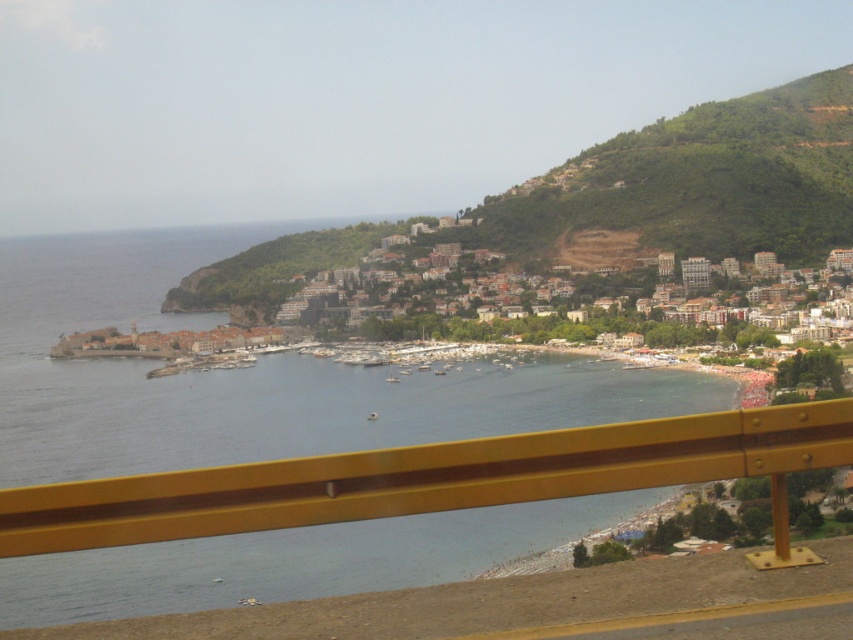
Question: Which point is closer to the camera taking this photo?

Choices:
 (A) [x=573, y=292]
 (B) [x=793, y=422]

Answer: (B)

Question: Which point is farther to the camera?

Choices:
 (A) (523, 472)
 (B) (339, 320)

Answer: (B)

Question: Among these objects, which one is nearest to the camera?

Choices:
 (A) brown stone buildings at center
 (B) yellow metallic rail at lower center

Answer: (B)

Question: Is yellow metallic rail at lower center below brown stone buildings at center?

Choices:
 (A) no
 (B) yes

Answer: (B)

Question: Does yellow metallic rail at lower center have a larger size compared to brown stone buildings at center?

Choices:
 (A) no
 (B) yes

Answer: (A)

Question: Does yellow metallic rail at lower center appear on the right side of brown stone buildings at center?

Choices:
 (A) no
 (B) yes

Answer: (A)